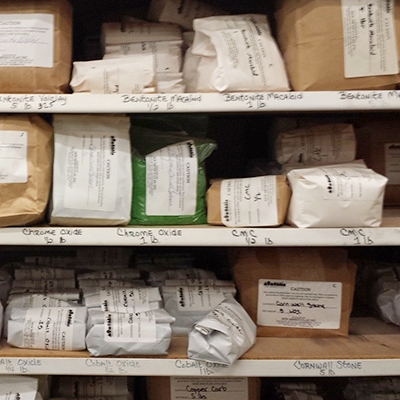
Image resolution: width=400 pixels, height=400 pixels. In order to click on box in this screenshot , I will do `click(282, 309)`.